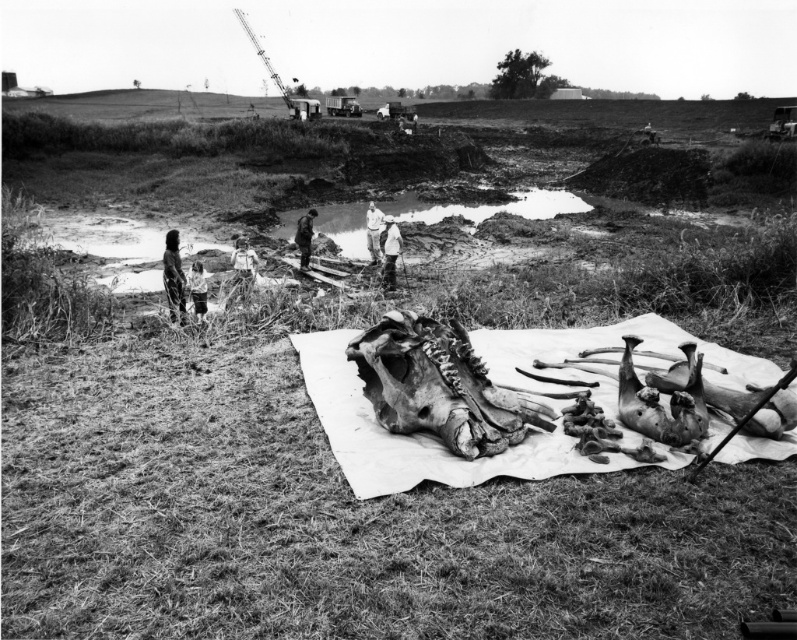
From the picture: Can you confirm if rusty metallic skull at center is wider than white cotton shirt at center?

Yes, rusty metallic skull at center is wider than white cotton shirt at center.

Which is in front, point (402, 326) or point (387, 259)?

Point (402, 326) is more forward.

This screenshot has width=797, height=640. Find the location of `rusty metallic skull at center`. rusty metallic skull at center is located at coordinates (438, 387).

Who is shorter, white cotton shirt at center or smooth skin child at center?

smooth skin child at center

This screenshot has height=640, width=797. What are the coordinates of `white cotton shirt at center` in the screenshot? It's located at (389, 252).

Locate an element on the screen. white cotton shirt at center is located at coordinates (389, 252).

Who is lower down, smooth skin human at center or white cotton shirt at center?

Positioned lower is smooth skin human at center.

Is point (171, 300) farther from camera compared to point (383, 260)?

No, it is in front of (383, 260).

Does point (171, 248) come closer to viewer compared to point (387, 285)?

That is True.

The image size is (797, 640). I want to click on smooth skin human at center, so click(x=173, y=276).